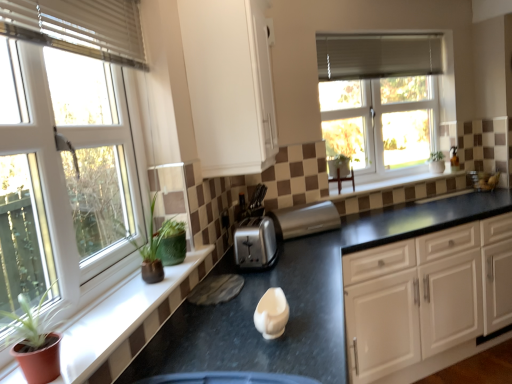
You are a GUI agent. You are given a task and a screenshot of the screen. Output one action in this format:
    pyautogui.click(x=<x>, y=<y>)
    Task: Click on the free space between green matte plant at left and green matte plant at left
    
    Given the screenshot: What is the action you would take?
    pyautogui.click(x=110, y=320)